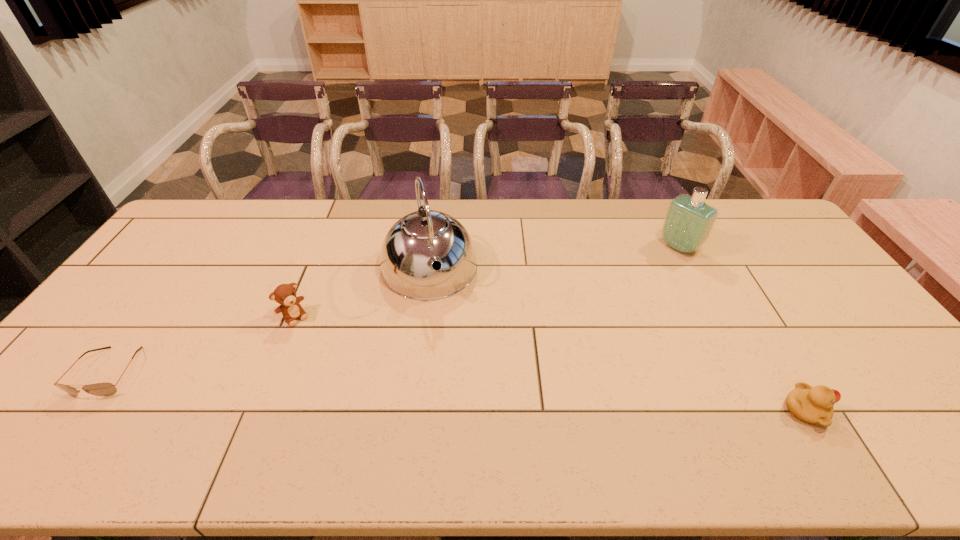
Point out which object is positioned as the second nearest to the tallest object. Please provide its 2D coordinates. Your answer should be formatted as a tuple, i.e. [(x, y)], where the tuple contains the x and y coordinates of a point satisfying the conditions above.

[(99, 389)]

Identify the location of vacant space that satisfies the following two spatial constraints: 1. on the front side of the third shortest object; 2. at the beak of the second shortest object. (256, 410).

At what (x,y) coordinates should I click in order to perform the action: click on free spot that satisfies the following two spatial constraints: 1. on the front-facing side of the second shortest object; 2. at the beak of the sunglasses. Please return your answer as a coordinate pair (x, y). The height and width of the screenshot is (540, 960). Looking at the image, I should click on (81, 410).

In order to click on vacant area that satisfies the following two spatial constraints: 1. on the front-facing side of the leftmost object; 2. at the beak of the second shortest object in this screenshot , I will do `click(81, 410)`.

Where is `vacant area that satisfies the following two spatial constraints: 1. on the back side of the third shortest object; 2. on the left side of the perfume`? The image size is (960, 540). vacant area that satisfies the following two spatial constraints: 1. on the back side of the third shortest object; 2. on the left side of the perfume is located at coordinates (324, 247).